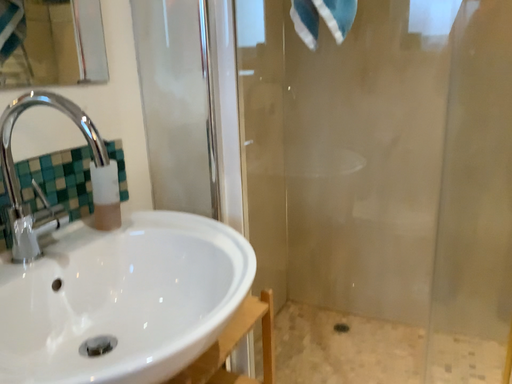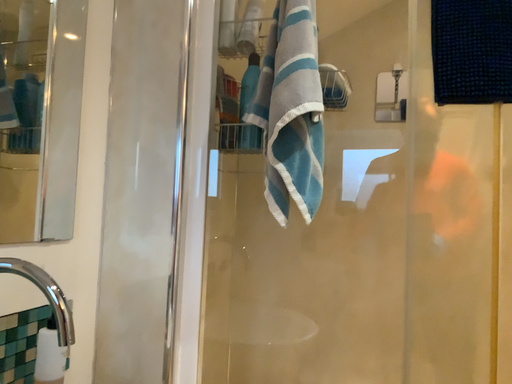
Question: Which way did the camera rotate in the video?

Choices:
 (A) rotated right
 (B) rotated left

Answer: (A)